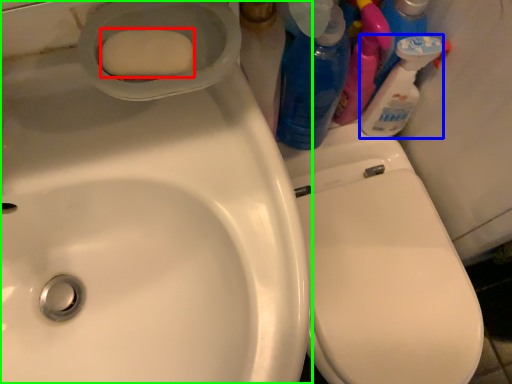
Question: Based on their relative distances, which object is nearer to soap (highlighted by a red box)? Choose from cleaning product (highlighted by a blue box) and sink (highlighted by a green box).

Choices:
 (A) cleaning product
 (B) sink

Answer: (B)